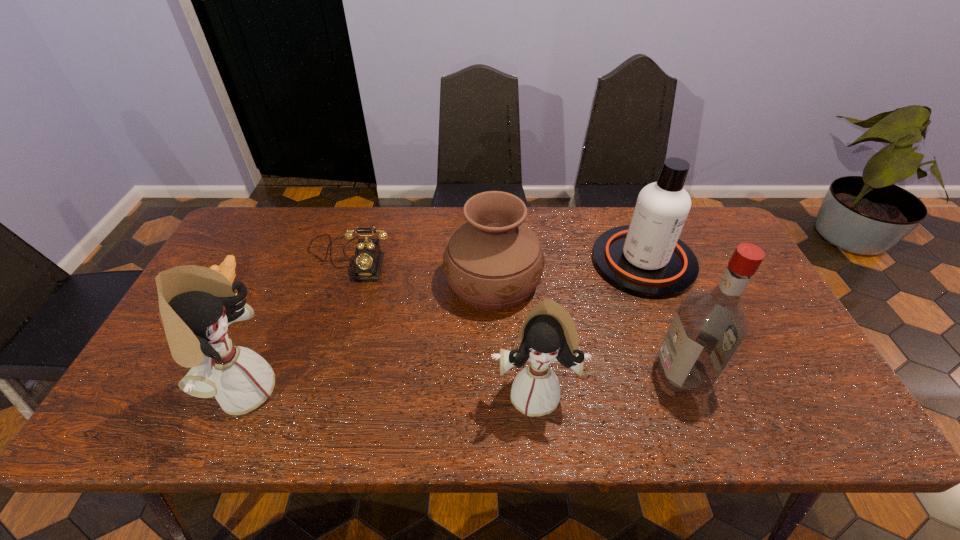
The width and height of the screenshot is (960, 540). Find the location of `free space between the liquor and the taller doll`. free space between the liquor and the taller doll is located at coordinates (463, 382).

Identify the location of free point between the urn and the right doll. The width and height of the screenshot is (960, 540). (514, 337).

Where is `free space between the shorter doll and the urn`? This screenshot has height=540, width=960. free space between the shorter doll and the urn is located at coordinates (514, 337).

In order to click on vacant region between the fifth tallest object and the liquor in this screenshot , I will do `click(588, 327)`.

Where is `unoccupied area between the shorter doll and the liquor`? This screenshot has height=540, width=960. unoccupied area between the shorter doll and the liquor is located at coordinates (609, 383).

Locate an element on the screen. The image size is (960, 540). free space between the urn and the left doll is located at coordinates (368, 336).

Where is `unoccupied position between the telephone and the left doll`? This screenshot has height=540, width=960. unoccupied position between the telephone and the left doll is located at coordinates (296, 324).

This screenshot has height=540, width=960. Identify the location of free space between the urn and the shorter doll. (514, 337).

Identify which object is located as the third nearest to the shortest object. Please provide its 2D coordinates. Your answer should be formatted as a tuple, i.e. [(x, y)], where the tuple contains the x and y coordinates of a point satisfying the conditions above.

[(493, 261)]

In order to click on object that is the fourth nearest to the left doll in this screenshot , I will do pyautogui.click(x=548, y=333).